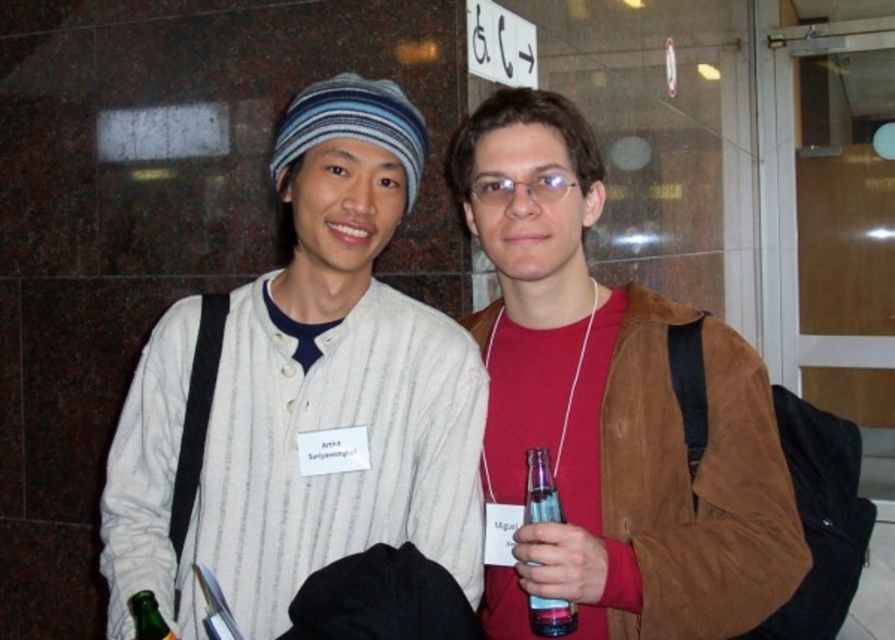
Based on the photo, does white striped shirt at center appear on the right side of green glass bottle at lower left?

Yes, white striped shirt at center is to the right of green glass bottle at lower left.

From the picture: Does white striped shirt at center appear on the left side of green glass bottle at lower left?

In fact, white striped shirt at center is to the right of green glass bottle at lower left.

Find the location of `white striped shirt at center`. white striped shirt at center is located at coordinates (305, 396).

Identify the location of white striped shirt at center. This screenshot has height=640, width=895. (305, 396).

Between brown suede jacket at center and green glass bottle at lower left, which one is positioned lower?

green glass bottle at lower left

Is brown suede jacket at center above green glass bottle at lower left?

Indeed, brown suede jacket at center is positioned over green glass bottle at lower left.

Between point (597, 192) and point (150, 618), which one is positioned behind?

The point (597, 192) is more distant.

I want to click on brown suede jacket at center, so click(611, 410).

Which is more to the right, translucent plastic bottle at center or green glass bottle at lower left?

Positioned to the right is translucent plastic bottle at center.

Is point (544, 460) less distant than point (139, 605)?

That is False.

Is point (550, 467) positioned in front of point (138, 596)?

No, it is not.

You are a GUI agent. You are given a task and a screenshot of the screen. Output one action in this format:
    pyautogui.click(x=<x>, y=<y>)
    Task: Click on the translucent plastic bottle at center
    The image size is (895, 640).
    Given the screenshot: What is the action you would take?
    point(540,490)